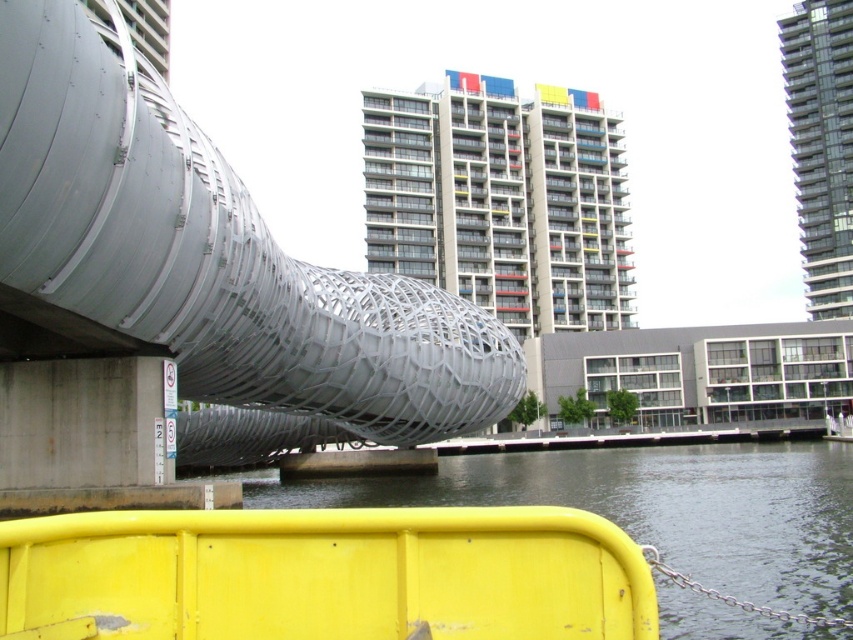
Question: Does metallic mesh bridge at center have a larger size compared to yellow plastic barrier at lower center?

Choices:
 (A) yes
 (B) no

Answer: (B)

Question: Does metallic mesh bridge at center have a larger size compared to yellow plastic barrier at lower center?

Choices:
 (A) no
 (B) yes

Answer: (A)

Question: Can you confirm if metallic mesh bridge at center is smaller than yellow plastic barrier at lower center?

Choices:
 (A) yes
 (B) no

Answer: (A)

Question: Which object is farther from the camera taking this photo?

Choices:
 (A) yellow matte rail at lower center
 (B) metallic mesh bridge at center
 (C) yellow plastic barrier at lower center

Answer: (B)

Question: Which is farther from the metallic mesh bridge at center?

Choices:
 (A) yellow plastic barrier at lower center
 (B) yellow matte rail at lower center

Answer: (A)

Question: Which point appears farthest from the camera in this image?

Choices:
 (A) (579, 536)
 (B) (38, 182)

Answer: (B)